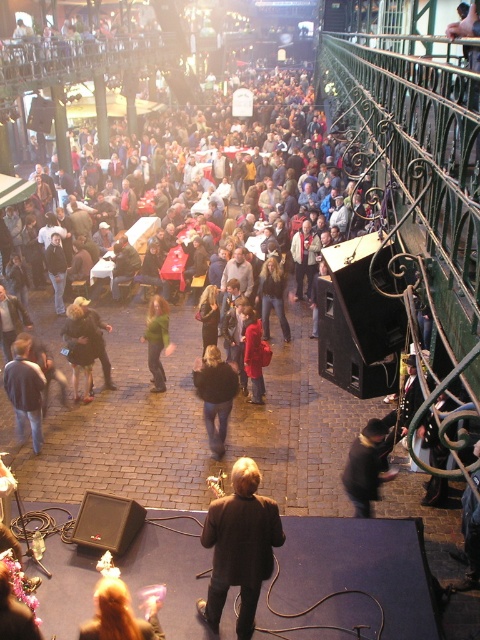
You are a photographer at the event and want to capture both the green fabric jacket at center and the red fabric coat at center in a single photo. Since you can only focus on one subject at a time, which one should you focus on to ensure the other is still in the background?

You should focus on the green fabric jacket at center because it is located above the red fabric coat at center, so the red fabric coat at center will naturally appear in the background.

You are at the event and want to find the person wearing the green fuzzy jacket at center. Which direction should you look relative to the red fabric coat at center?

The green fuzzy jacket at center is located above the red fabric coat at center, so you should look upwards from the red fabric coat at center to find the green fuzzy jacket at center.